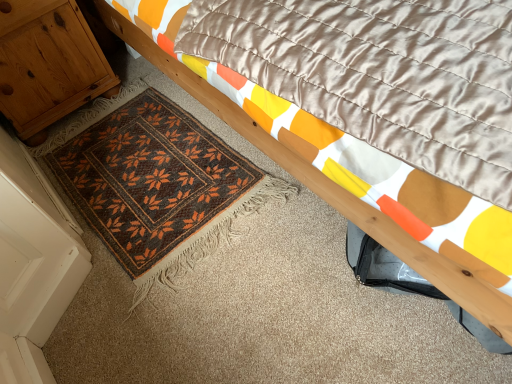
Question: Is wooden cabinet at left taller than brown woven mat at lower left?

Choices:
 (A) yes
 (B) no

Answer: (A)

Question: Is wooden cabinet at left outside brown woven mat at lower left?

Choices:
 (A) yes
 (B) no

Answer: (A)

Question: Is wooden cabinet at left further to camera compared to brown woven mat at lower left?

Choices:
 (A) no
 (B) yes

Answer: (B)

Question: Is brown woven mat at lower left at the back of wooden cabinet at left?

Choices:
 (A) yes
 (B) no

Answer: (B)

Question: Can you confirm if wooden cabinet at left is shorter than brown woven mat at lower left?

Choices:
 (A) yes
 (B) no

Answer: (B)

Question: From a real-world perspective, is brown woven mat at lower left positioned above or below wooden bed frame at upper right?

Choices:
 (A) below
 (B) above

Answer: (A)

Question: From the image's perspective, is brown woven mat at lower left located above or below wooden bed frame at upper right?

Choices:
 (A) above
 (B) below

Answer: (B)

Question: Visually, is brown woven mat at lower left positioned to the left or to the right of wooden bed frame at upper right?

Choices:
 (A) left
 (B) right

Answer: (A)

Question: Considering the positions of point (119, 96) and point (417, 259), is point (119, 96) closer or farther from the camera than point (417, 259)?

Choices:
 (A) closer
 (B) farther

Answer: (B)

Question: Is point (40, 77) positioned closer to the camera than point (95, 208)?

Choices:
 (A) farther
 (B) closer

Answer: (A)

Question: In terms of width, does wooden cabinet at left look wider or thinner when compared to brown woven mat at lower left?

Choices:
 (A) thin
 (B) wide

Answer: (A)

Question: Is wooden cabinet at left in front of or behind brown woven mat at lower left in the image?

Choices:
 (A) behind
 (B) front

Answer: (A)

Question: Visually, is wooden cabinet at left positioned to the left or to the right of brown woven mat at lower left?

Choices:
 (A) left
 (B) right

Answer: (A)

Question: Considering the positions of point (72, 109) and point (502, 312), is point (72, 109) closer or farther from the camera than point (502, 312)?

Choices:
 (A) farther
 (B) closer

Answer: (A)

Question: Relative to wooden bed frame at upper right, is wooden cabinet at left in front or behind?

Choices:
 (A) behind
 (B) front

Answer: (A)